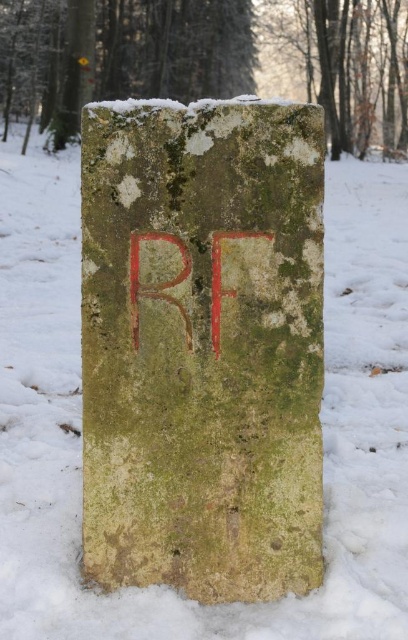
Is red stone rf at center positioned in front of green mossy stone at upper left?

Yes, it is.

Who is more forward, (x=210, y=288) or (x=64, y=115)?

Point (x=210, y=288) is more forward.

Is point (224, 292) positioned behind point (66, 116)?

No, (224, 292) is in front of (66, 116).

The image size is (408, 640). What are the coordinates of `red stone rf at center` in the screenshot? It's located at pyautogui.click(x=157, y=282).

Which of these two, green mossy stone at center or green mossy stone at upper left, stands taller?

Standing taller between the two is green mossy stone at upper left.

Which of these two, green mossy stone at center or green mossy stone at upper left, stands shorter?

Standing shorter between the two is green mossy stone at center.

Which is behind, point (175, 321) or point (55, 122)?

The point (55, 122) is behind.

Identify the location of green mossy stone at center. This screenshot has height=640, width=408. (201, 346).

Measure the distance between green mossy stone at center and camera.

green mossy stone at center is 7.93 feet from camera.

Who is shorter, green mossy stone at center or red stone rf at center?

red stone rf at center

Is point (226, 250) closer to camera compared to point (250, 236)?

No, it is not.

Identify the location of green mossy stone at center. The width and height of the screenshot is (408, 640). (201, 346).